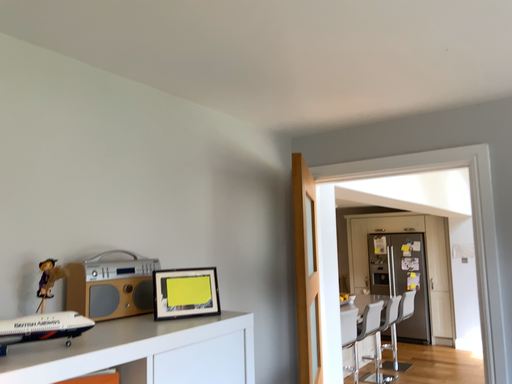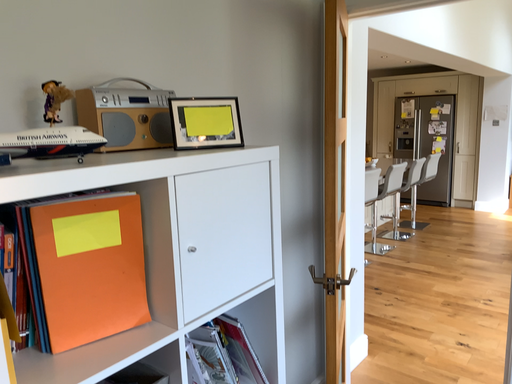
Question: Which way did the camera rotate in the video?

Choices:
 (A) rotated upward
 (B) rotated downward

Answer: (B)